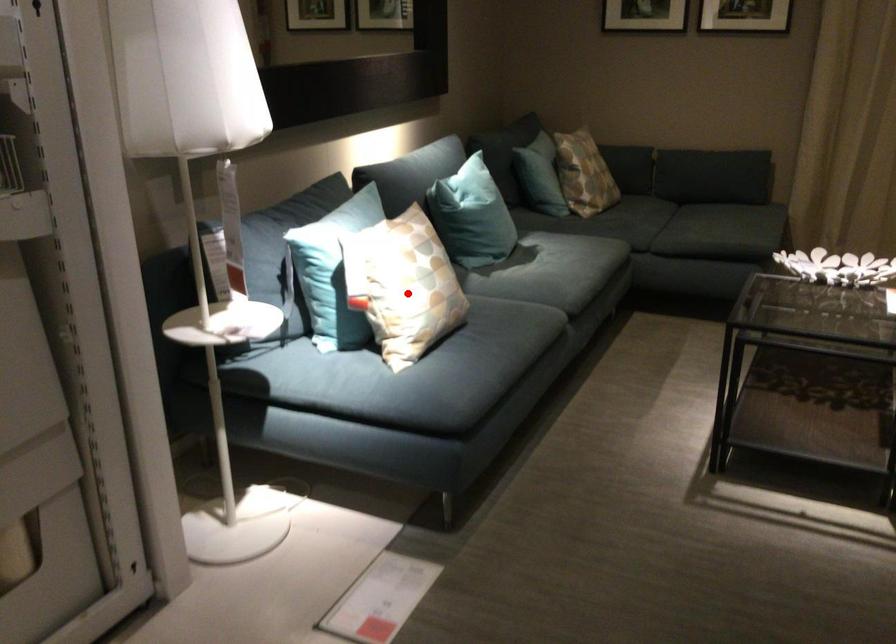
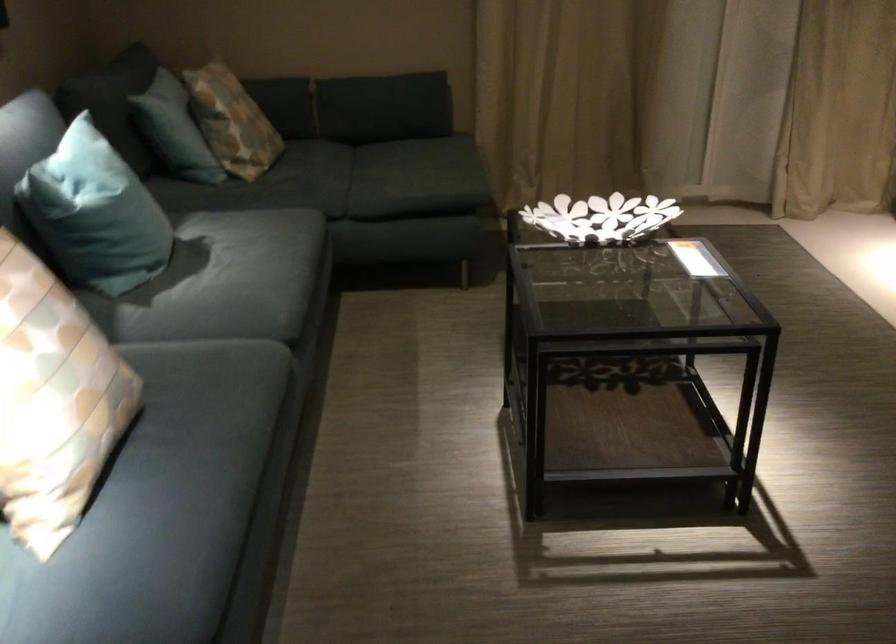
In the second image, find the point that corresponds to the highlighted location in the first image.

(53, 401)